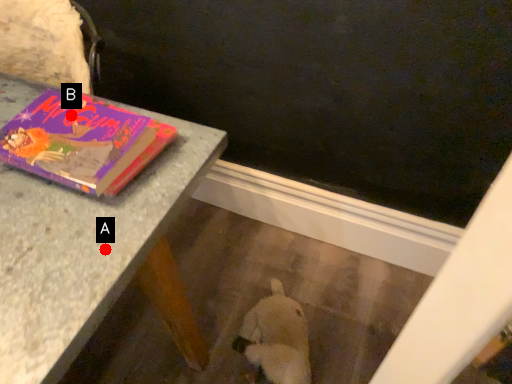
Question: Two points are circled on the image, labeled by A and B beside each circle. Which point is farther from the camera taking this photo?

Choices:
 (A) A is further
 (B) B is further

Answer: (B)